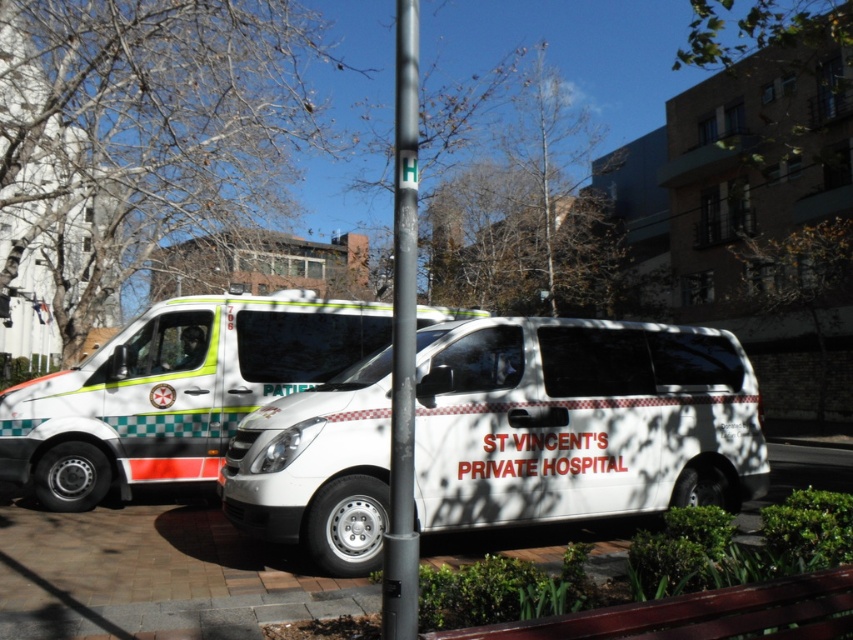
You are a delivery person trying to park your car between the white glossy van at left and the black smooth pole at center. Can you park your car there without hitting either object?

The white glossy van at left is below the black smooth pole at center, meaning there is space between them. However, since the van is positioned lower than the pole, the vertical clearance might be sufficient, but horizontal distance isn

You are a pedestrian standing at the intersection and see two emergency vehicles parked on the street. You notice two points marked on the vehicles. One is at point [187,406] and the other is at point [403,45]. Which point is closer to you?

Point [403,45] is closer to you because it is in front of point [187,406].